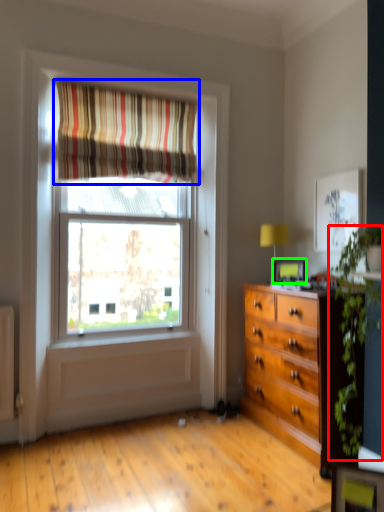
Question: Which is farther away from plant (highlighted by a red box)? curtain (highlighted by a blue box) or picture frame (highlighted by a green box)?

Choices:
 (A) curtain
 (B) picture frame

Answer: (A)